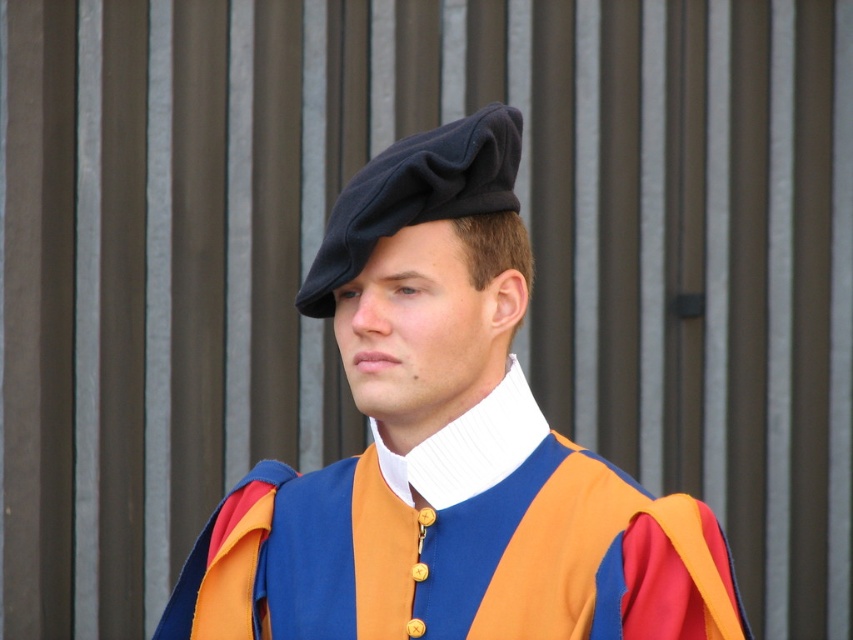
You are a costume designer preparing for a historical play. You have two berets available for the main character. The first is a matte black beret at center and the second is a black felt beret at center. The script requires the character to wear a larger beret to emphasize their status. Which beret should you choose?

The matte black beret at center is larger in size than the black felt beret at center, so you should choose the matte black beret at center to emphasize the character s status.

You are standing in front of the person in the image. There are two points marked on the image. One is at coordinates point (509, 332) and the other is at point (479, 214). Which point is closer to you?

Point (509, 332) is closer to you because it is further to the viewer than point (479, 214).

Looking at this image, you are an assistant helping to organize a costume collection. You see two hats labeled as matte black beret at center and black felt beret at center in the image. According to the description, which hat is positioned lower on the person?

The matte black beret at center is positioned lower because it is below the black felt beret at center.